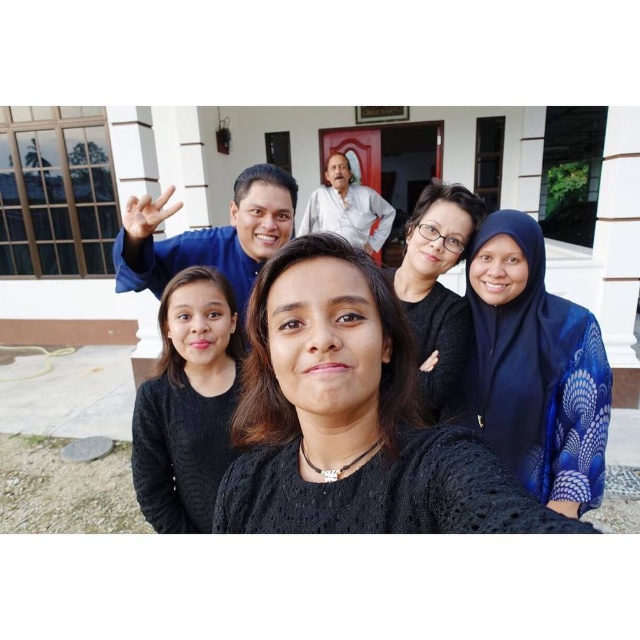
You are standing in front of the building and want to take a photo of the black matte dress at center. Which direction should you face to ensure the dress is in the center of your photo?

You should face towards the center of the image where the black matte dress at center is located, which is at coordinates approximately 0.653 on the x axis and 0.550 on the y axis.

You are standing in front of the building and want to take a photo of the two people wearing the black knitted sweater at center and the white cotton shirt at upper center. Which one will appear larger in the photo?

The black knitted sweater at center will appear larger in the photo because it is closer to the viewer than the white cotton shirt at upper center.

You are a photographer trying to capture the perfect shot of the black matte dress at center and the blue silk hijab at right. Since you want to emphasize both items equally, which one should you zoom in on more to balance their sizes in the photo?

The black matte dress at center is wider than the blue silk hijab at right. To balance their sizes, you should zoom in slightly more on the blue silk hijab at right to make it appear larger in the frame compared to the black matte dress at center.